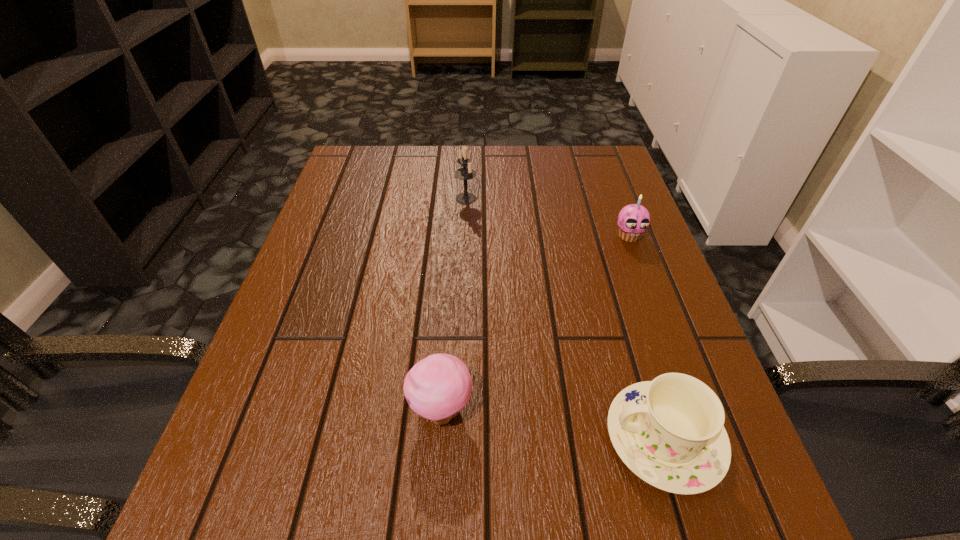
In the image, there is a desktop. At what (x,y) coordinates should I click in order to perform the action: click on blank space at the far right corner. Please return your answer as a coordinate pair (x, y). The height and width of the screenshot is (540, 960). Looking at the image, I should click on (584, 193).

At what (x,y) coordinates should I click in order to perform the action: click on blank region between the chinaware and the nearer cupcake. Please return your answer as a coordinate pair (x, y). Looking at the image, I should click on (553, 424).

Where is `vacant region between the chinaware and the tallest object`? vacant region between the chinaware and the tallest object is located at coordinates (565, 318).

In order to click on unoccupied position between the chinaware and the candle holder in this screenshot , I will do `click(565, 318)`.

The width and height of the screenshot is (960, 540). I want to click on vacant space that's between the farthest object and the third nearest object, so click(547, 217).

Where is `vacant space that's between the second farthest object and the chinaware`? The width and height of the screenshot is (960, 540). vacant space that's between the second farthest object and the chinaware is located at coordinates (647, 337).

You are a GUI agent. You are given a task and a screenshot of the screen. Output one action in this format:
    pyautogui.click(x=<x>, y=<y>)
    Task: Click on the free space between the farthest object and the chinaware
    The image size is (960, 540).
    Given the screenshot: What is the action you would take?
    pyautogui.click(x=565, y=318)

Locate an element on the screen. free spot between the second farthest object and the chinaware is located at coordinates (647, 337).

I want to click on free spot between the third nearest object and the nearer cupcake, so click(x=535, y=323).

Identify the location of vacant region between the chinaware and the farther cupcake. (647, 337).